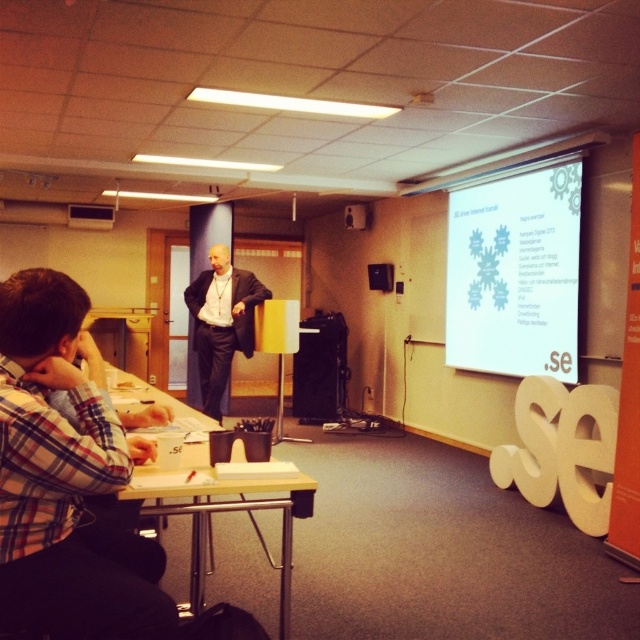
Consider the image. You are sitting at the table and want to look at both the plaid shirt at lower left and the white matte projection screen at upper right. Which one will you have to tilt your head up more to see?

You will have to tilt your head up more to see the white matte projection screen at upper right because it is positioned higher up on the wall compared to the plaid shirt at lower left, which is closer to the viewer and likely at a lower eye level.

You are sitting at the table in the presentation room and see two points marked on the floor. The first point is at coordinate point(38, 611) and the second point is at coordinate point(541, 332). Which point is closer to you?

Point(38, 611) is in front of point(541, 332), so it is closer to you.